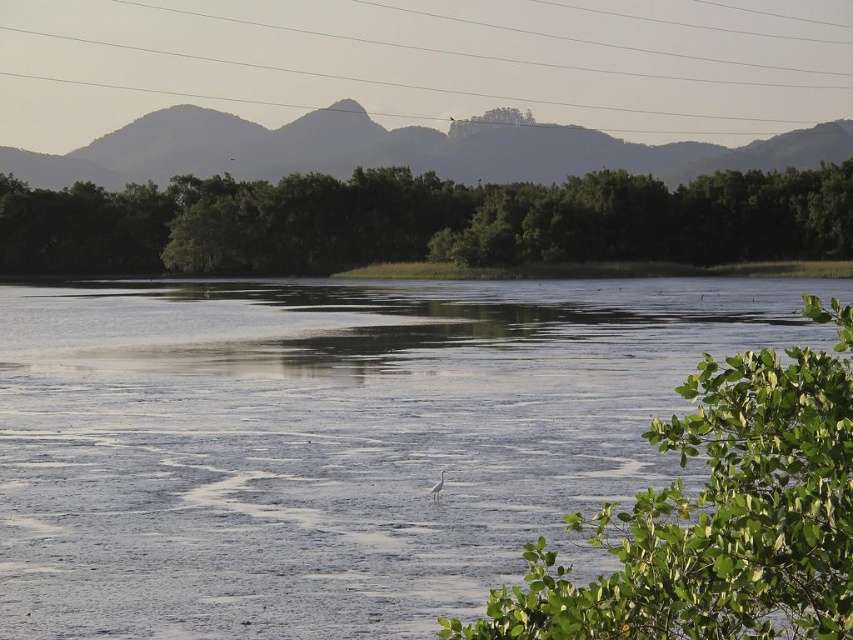
You are standing at the center of the image and want to walk towards the green leafy trees at center. In which direction should you move?

You should move towards the center of the image because the green leafy trees at center are located there.

Based on the scene description, which object is closer to the observer, the green leafy trees at center or the silvery gray mountain at upper center?

The green leafy trees at center are closer to the observer because they are positioned under the silvery gray mountain at upper center, indicating a layered arrangement with the trees in the midground and the mountain in the background.